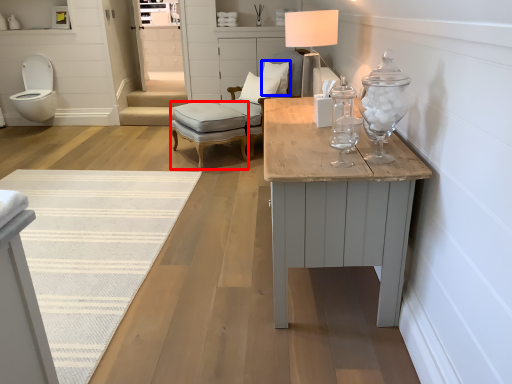
Question: Among these objects, which one is farthest to the camera, stool (highlighted by a red box) or pillow (highlighted by a blue box)?

Choices:
 (A) stool
 (B) pillow

Answer: (B)